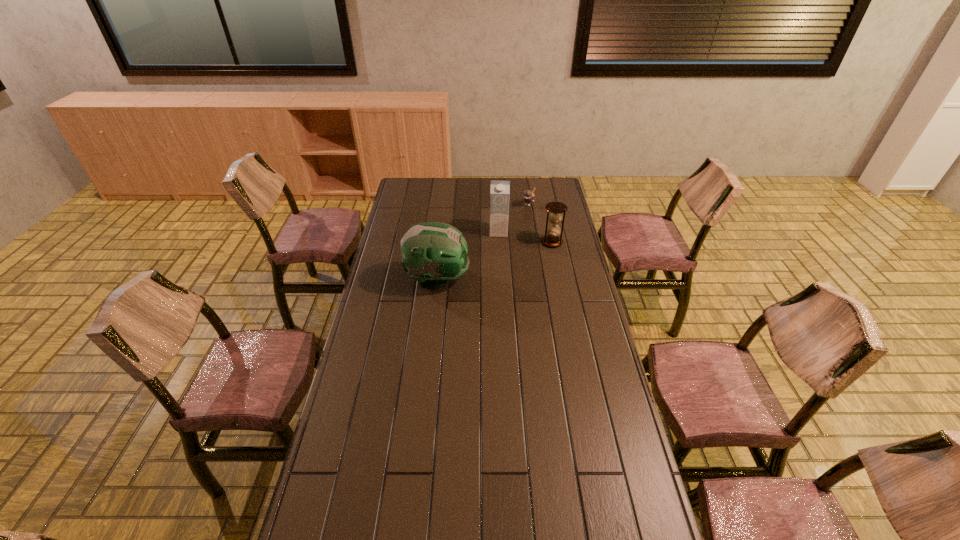
Locate an element on the screen. the nearest object is located at coordinates (432, 253).

Locate an element on the screen. football helmet is located at coordinates (432, 253).

Where is `the third tallest object`? This screenshot has height=540, width=960. the third tallest object is located at coordinates (556, 208).

The image size is (960, 540). I want to click on kitten, so click(529, 196).

The image size is (960, 540). I want to click on the farthest object, so click(x=529, y=196).

Where is `the third object from right to left`? The height and width of the screenshot is (540, 960). the third object from right to left is located at coordinates coord(500,190).

At what (x,y) coordinates should I click in order to perform the action: click on free spot located on the visor of the football helmet. Please return your answer as a coordinate pair (x, y). The image size is (960, 540). Looking at the image, I should click on (484, 279).

Image resolution: width=960 pixels, height=540 pixels. In order to click on free region located on the back of the second shortest object in this screenshot , I will do [x=547, y=220].

Locate an element on the screen. vacant space located 0.340m on the front-facing side of the farthest object is located at coordinates (500, 244).

This screenshot has width=960, height=540. What are the coordinates of `free space located on the front-facing side of the farthest object` in the screenshot? It's located at (512, 229).